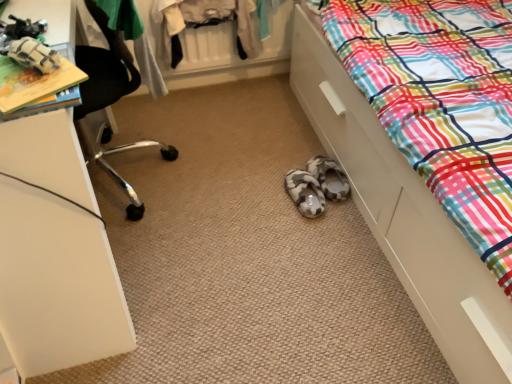
Question: Considering their positions, is multicolored plaid fabric at lower right located in front of or behind black mesh chair at upper left?

Choices:
 (A) front
 (B) behind

Answer: (A)

Question: Is point (387, 180) closer or farther from the camera than point (112, 46)?

Choices:
 (A) closer
 (B) farther

Answer: (A)

Question: In terms of height, does multicolored plaid fabric at lower right look taller or shorter compared to black mesh chair at upper left?

Choices:
 (A) short
 (B) tall

Answer: (B)

Question: From a real-world perspective, relative to multicolored plaid fabric at lower right, is black mesh chair at upper left vertically above or below?

Choices:
 (A) above
 (B) below

Answer: (A)

Question: Is black mesh chair at upper left inside or outside of multicolored plaid fabric at lower right?

Choices:
 (A) outside
 (B) inside

Answer: (A)

Question: Does point (174, 150) appear closer or farther from the camera than point (428, 228)?

Choices:
 (A) farther
 (B) closer

Answer: (A)

Question: Considering the positions of black mesh chair at upper left and multicolored plaid fabric at lower right in the image, is black mesh chair at upper left bigger or smaller than multicolored plaid fabric at lower right?

Choices:
 (A) big
 (B) small

Answer: (B)